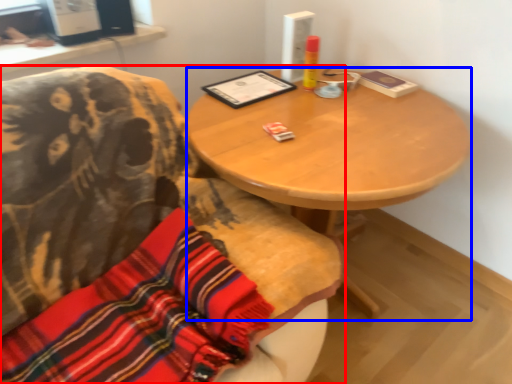
Question: Which object appears farthest to the camera in this image, chair (highlighted by a red box) or desk (highlighted by a blue box)?

Choices:
 (A) chair
 (B) desk

Answer: (B)